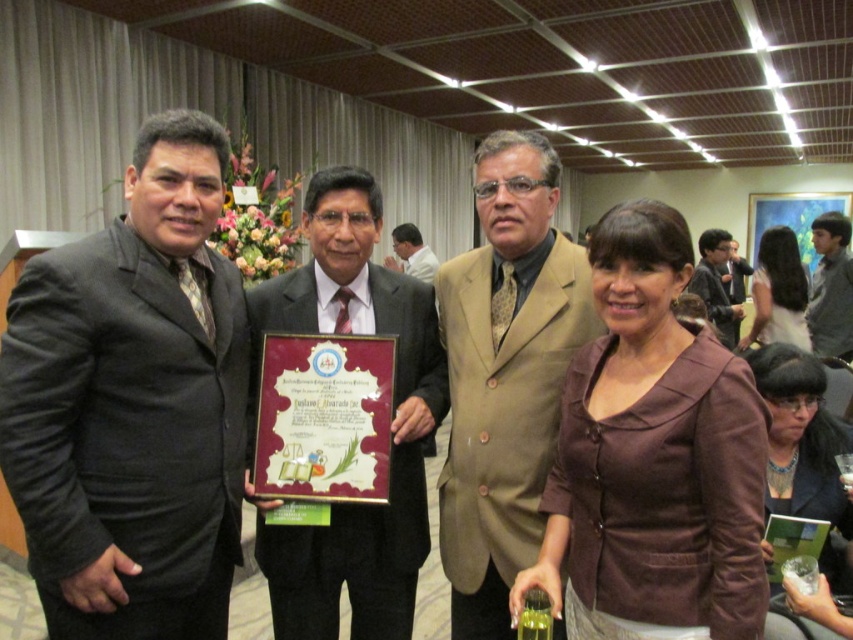
Question: Is shiny black suit at center closer to the viewer compared to green glass at lower center?

Choices:
 (A) yes
 (B) no

Answer: (B)

Question: Which of these objects is positioned farthest from the dark gray suit at left?

Choices:
 (A) dark brown suit at right
 (B) brown textured suit at center

Answer: (A)

Question: Which of these objects is positioned closest to the dark gray suit at left?

Choices:
 (A) brown fabric dress at center
 (B) dark brown suit at right

Answer: (A)

Question: Does shiny black suit at center have a larger size compared to green glass at lower center?

Choices:
 (A) yes
 (B) no

Answer: (A)

Question: Is brown textured suit at center above dark gray suit at right?

Choices:
 (A) yes
 (B) no

Answer: (B)

Question: Among these points, which one is farthest from the camera?

Choices:
 (A) (485, 477)
 (B) (817, 438)

Answer: (B)